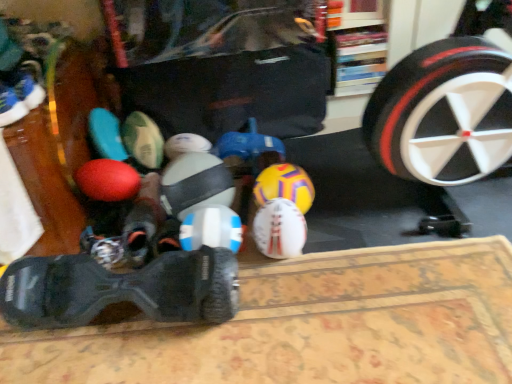
What is the approximate width of white matte soccer ball at center, the 1th toy in the left-to-right sequence?

The width of white matte soccer ball at center, the 1th toy in the left-to-right sequence, is 23.89 centimeters.

Describe the element at coordinates (285, 186) in the screenshot. This screenshot has height=384, width=512. I see `yellow matte soccer ball at center, which is counted as the 1th toy, starting from the right` at that location.

Image resolution: width=512 pixels, height=384 pixels. What do you see at coordinates (279, 229) in the screenshot?
I see `white matte soccer ball at center, arranged as the 2th toy when viewed from the right` at bounding box center [279, 229].

Describe the element at coordinates (307, 325) in the screenshot. I see `carpeted mat at lower center` at that location.

Image resolution: width=512 pixels, height=384 pixels. Describe the element at coordinates (11, 107) in the screenshot. I see `blue suede shoe at left, the first footwear when ordered from left to right` at that location.

Find the location of a particular element. Image resolution: width=512 pixels, height=384 pixels. black rubber remote control at lower left, which ranks as the 2th footwear in left-to-right order is located at coordinates (120, 289).

Is point (259, 248) positioned behind point (2, 115)?

Yes, it is behind point (2, 115).

Is white matte soccer ball at center, marked as the 3th toy in a left-to-right arrangement, facing away from blue suede shoe at left, the first footwear when ordered from left to right?

white matte soccer ball at center, marked as the 3th toy in a left-to-right arrangement, does not have its back to blue suede shoe at left, the first footwear when ordered from left to right.

From a real-world perspective, which object stands above the other?

In real-world perspective, blue suede shoe at left, the first footwear when ordered from left to right, is above.

What's the angular difference between yellow matte soccer ball at center, which is counted as the 1th toy, starting from the right, and carpeted mat at lower center's facing directions?

1.38 degrees separate the facing orientations of yellow matte soccer ball at center, which is counted as the 1th toy, starting from the right, and carpeted mat at lower center.

Does yellow matte soccer ball at center, arranged as the 4th toy when viewed from the left, lie in front of carpeted mat at lower center?

No.

In the scene shown: Which point is more distant from viewer, [285,186] or [401,332]?

The point [285,186] is farther from the camera.

From the image's perspective, is yellow matte soccer ball at center, which is counted as the 1th toy, starting from the right, located beneath carpeted mat at lower center?

No, from the image's perspective, yellow matte soccer ball at center, which is counted as the 1th toy, starting from the right, is not beneath carpeted mat at lower center.

Is white plastic remote control at center, arranged as the 3th toy when viewed from the right, looking in the opposite direction of blue suede shoe at left, which appears as the first footwear when viewed from the top?

No, white plastic remote control at center, arranged as the 3th toy when viewed from the right, is not facing the opposite direction of blue suede shoe at left, which appears as the first footwear when viewed from the top.

The width and height of the screenshot is (512, 384). Identify the location of toy that is the 4th one below the blue suede shoe at left, which is counted as the second footwear, starting from the bottom (from a real-world perspective). (210, 228).

Would you consider white plastic remote control at center, the 2th toy viewed from the left, to be distant from blue suede shoe at left, which is counted as the second footwear, starting from the bottom?

No, white plastic remote control at center, the 2th toy viewed from the left, is not far from blue suede shoe at left, which is counted as the second footwear, starting from the bottom.

From their relative heights in the image, would you say white plastic remote control at center, the 2th toy viewed from the left, is taller or shorter than blue suede shoe at left, the first footwear when ordered from left to right?

In the image, white plastic remote control at center, the 2th toy viewed from the left, appears to be taller than blue suede shoe at left, the first footwear when ordered from left to right.

Considering the sizes of objects white matte soccer ball at center, arranged as the 2th toy when viewed from the right, and black rubber remote control at lower left, marked as the first footwear in a bottom-to-top arrangement, in the image provided, who is bigger, white matte soccer ball at center, arranged as the 2th toy when viewed from the right, or black rubber remote control at lower left, marked as the first footwear in a bottom-to-top arrangement,?

With larger size is black rubber remote control at lower left, marked as the first footwear in a bottom-to-top arrangement.

Is white matte soccer ball at center, marked as the 3th toy in a left-to-right arrangement, in front of or behind black rubber remote control at lower left, which appears as the second footwear when viewed from the top, in the image?

white matte soccer ball at center, marked as the 3th toy in a left-to-right arrangement, is behind black rubber remote control at lower left, which appears as the second footwear when viewed from the top.

Can you confirm if white matte soccer ball at center, marked as the 3th toy in a left-to-right arrangement, is thinner than black rubber remote control at lower left, marked as the first footwear in a bottom-to-top arrangement?

Indeed, white matte soccer ball at center, marked as the 3th toy in a left-to-right arrangement, has a lesser width compared to black rubber remote control at lower left, marked as the first footwear in a bottom-to-top arrangement.

Is white matte soccer ball at center, arranged as the 2th toy when viewed from the right, turned away from black rubber remote control at lower left, the 1th footwear from the right?

No.

Does point (181, 226) lie behind point (284, 255)?

Yes, it is behind point (284, 255).

From a real-world perspective, who is located lower, white plastic remote control at center, the 2th toy viewed from the left, or white matte soccer ball at center, arranged as the 2th toy when viewed from the right?

In real-world perspective, white plastic remote control at center, the 2th toy viewed from the left, is lower.

Is there a large distance between white plastic remote control at center, the 2th toy viewed from the left, and white matte soccer ball at center, marked as the 3th toy in a left-to-right arrangement?

white plastic remote control at center, the 2th toy viewed from the left, is near white matte soccer ball at center, marked as the 3th toy in a left-to-right arrangement, not far away.

Which of these two, white plastic remote control at center, the 2th toy viewed from the left, or white matte soccer ball at center, arranged as the 2th toy when viewed from the right, stands shorter?

white plastic remote control at center, the 2th toy viewed from the left.

In the scene shown: Is white matte soccer ball at center, the 1th toy in the left-to-right sequence, in front of or behind carpeted mat at lower center in the image?

Visually, white matte soccer ball at center, the 1th toy in the left-to-right sequence, is located behind carpeted mat at lower center.

Which of these two, white matte soccer ball at center, the fourth toy from the right, or carpeted mat at lower center, stands taller?

white matte soccer ball at center, the fourth toy from the right, is taller.

This screenshot has width=512, height=384. In order to click on mat that is on the right side of white matte soccer ball at center, the fourth toy from the right in this screenshot , I will do `click(307, 325)`.

Does white matte soccer ball at center, the 1th toy in the left-to-right sequence, turn towards carpeted mat at lower center?

Yes, white matte soccer ball at center, the 1th toy in the left-to-right sequence, is facing carpeted mat at lower center.

From the image's perspective, is carpeted mat at lower center on top of white matte soccer ball at center, the fourth toy from the right?

Actually, carpeted mat at lower center appears below white matte soccer ball at center, the fourth toy from the right, in the image.

From a real-world perspective, between carpeted mat at lower center and white matte soccer ball at center, the fourth toy from the right, who is vertically lower?

carpeted mat at lower center, from a real-world perspective.

Is carpeted mat at lower center completely or partially outside of white matte soccer ball at center, the fourth toy from the right?

Yes, carpeted mat at lower center is not within white matte soccer ball at center, the fourth toy from the right.

Is carpeted mat at lower center in front of or behind white matte soccer ball at center, the 1th toy in the left-to-right sequence, in the image?

Visually, carpeted mat at lower center is located in front of white matte soccer ball at center, the 1th toy in the left-to-right sequence.

From the white matte soccer ball at center, arranged as the 2th toy when viewed from the right, count 1st footwears forward and point to it. Please provide its 2D coordinates.

[(11, 107)]

I want to click on toy that is the 4th object located behind the carpeted mat at lower center, so click(x=285, y=186).

In the scene shown: Based on their spatial positions, is black rubber remote control at lower left, which ranks as the 2th footwear in left-to-right order, or white matte soccer ball at center, arranged as the 2th toy when viewed from the right, further from yellow matte soccer ball at center, arranged as the 4th toy when viewed from the left?

Based on the image, black rubber remote control at lower left, which ranks as the 2th footwear in left-to-right order, appears to be further to yellow matte soccer ball at center, arranged as the 4th toy when viewed from the left.

Looking at the image, which one is located further to white plastic remote control at center, the 2th toy viewed from the left, black rubber remote control at lower left, which ranks as the 2th footwear in left-to-right order, or carpeted mat at lower center?

carpeted mat at lower center is positioned further to the anchor white plastic remote control at center, the 2th toy viewed from the left.

Looking at the image, which one is located closer to yellow matte soccer ball at center, arranged as the 4th toy when viewed from the left, white plastic remote control at center, arranged as the 3th toy when viewed from the right, or white matte soccer ball at center, arranged as the 2th toy when viewed from the right?

The object closer to yellow matte soccer ball at center, arranged as the 4th toy when viewed from the left, is white matte soccer ball at center, arranged as the 2th toy when viewed from the right.

From the image, which object appears to be nearer to yellow matte soccer ball at center, arranged as the 4th toy when viewed from the left, carpeted mat at lower center or blue suede shoe at left, which is counted as the 2th footwear, starting from the right?

The object closer to yellow matte soccer ball at center, arranged as the 4th toy when viewed from the left, is carpeted mat at lower center.

In the scene shown: From the image, which object appears to be farther from carpeted mat at lower center, blue suede shoe at left, which appears as the first footwear when viewed from the top, or white plastic remote control at center, arranged as the 3th toy when viewed from the right?

blue suede shoe at left, which appears as the first footwear when viewed from the top, is positioned further to the anchor carpeted mat at lower center.

From the image, which object appears to be farther from white plastic remote control at center, arranged as the 3th toy when viewed from the right, yellow matte soccer ball at center, arranged as the 4th toy when viewed from the left, or blue suede shoe at left, which is counted as the 2th footwear, starting from the right?

The object further to white plastic remote control at center, arranged as the 3th toy when viewed from the right, is blue suede shoe at left, which is counted as the 2th footwear, starting from the right.

Which object lies further to the anchor point yellow matte soccer ball at center, which is counted as the 1th toy, starting from the right, carpeted mat at lower center or black rubber remote control at lower left, the 1th footwear from the right?

Among the two, black rubber remote control at lower left, the 1th footwear from the right, is located further to yellow matte soccer ball at center, which is counted as the 1th toy, starting from the right.

Based on their spatial positions, is carpeted mat at lower center or blue suede shoe at left, the first footwear when ordered from left to right, closer to white plastic remote control at center, the 2th toy viewed from the left?

carpeted mat at lower center is positioned closer to the anchor white plastic remote control at center, the 2th toy viewed from the left.

Where is `toy between white matte soccer ball at center, the 1th toy in the left-to-right sequence, and white matte soccer ball at center, marked as the 3th toy in a left-to-right arrangement, in the horizontal direction`? This screenshot has height=384, width=512. toy between white matte soccer ball at center, the 1th toy in the left-to-right sequence, and white matte soccer ball at center, marked as the 3th toy in a left-to-right arrangement, in the horizontal direction is located at coordinates (210, 228).

Find the location of a particular element. toy between blue suede shoe at left, which appears as the first footwear when viewed from the top, and white plastic remote control at center, arranged as the 3th toy when viewed from the right, from left to right is located at coordinates (195, 183).

Locate an element on the screen. mat located between black rubber remote control at lower left, marked as the first footwear in a bottom-to-top arrangement, and yellow matte soccer ball at center, which is counted as the 1th toy, starting from the right, in the left-right direction is located at coordinates (307, 325).

Where is `toy between white plastic remote control at center, the 2th toy viewed from the left, and yellow matte soccer ball at center, which is counted as the 1th toy, starting from the right, from left to right`? toy between white plastic remote control at center, the 2th toy viewed from the left, and yellow matte soccer ball at center, which is counted as the 1th toy, starting from the right, from left to right is located at coordinates (279, 229).